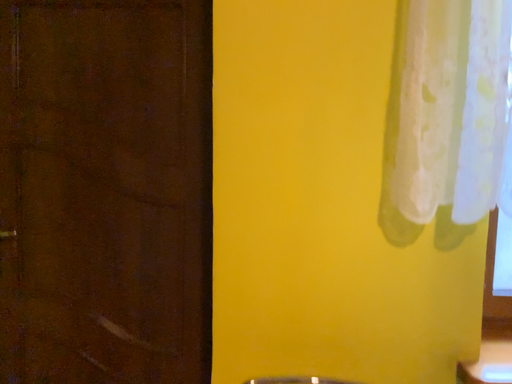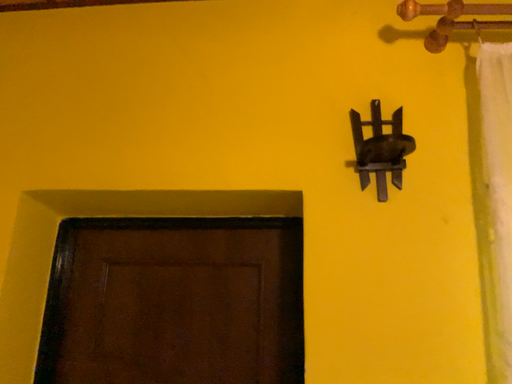
Question: Which way did the camera rotate in the video?

Choices:
 (A) rotated downward
 (B) rotated upward

Answer: (B)